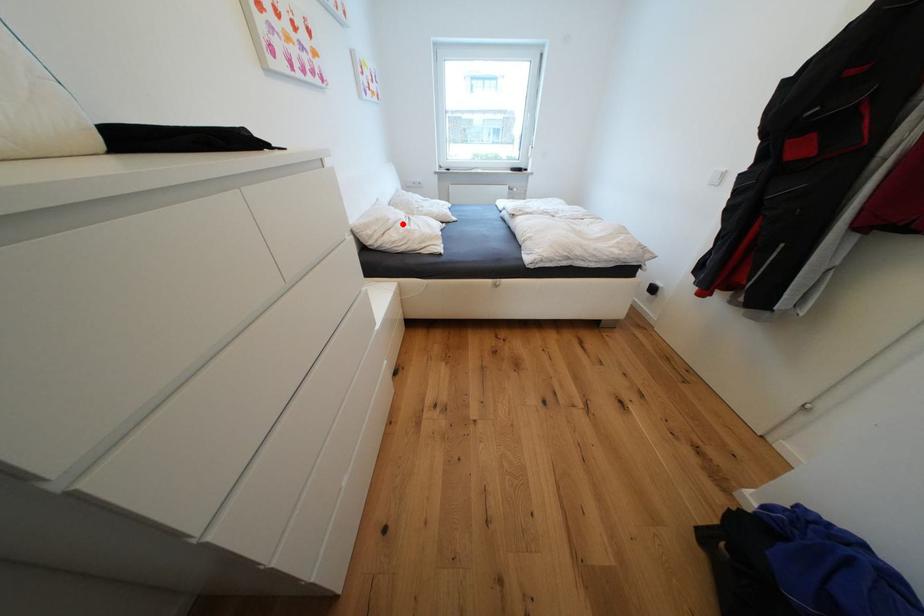
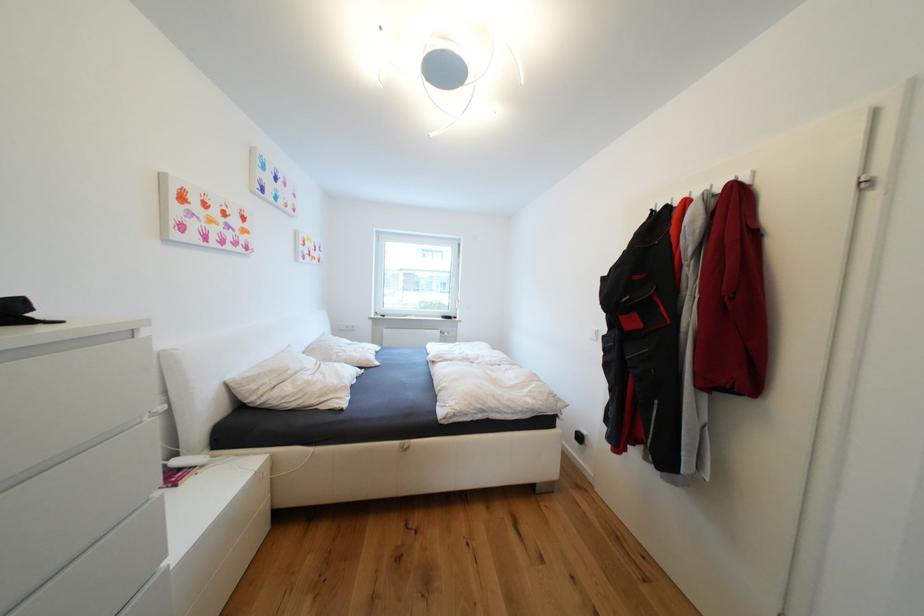
Find the pixel in the second image that matches the highlighted location in the first image.

(304, 374)